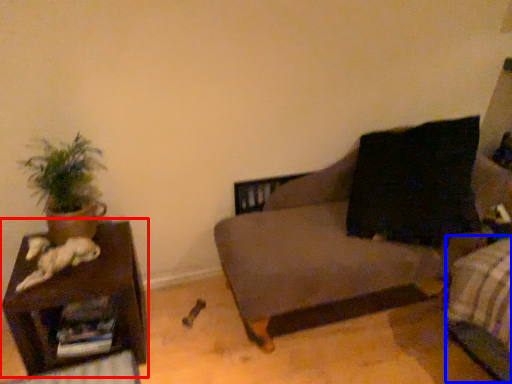
Question: Which point is closer to the camera, furniture (highlighted by a red box) or bed frame (highlighted by a blue box)?

Choices:
 (A) furniture
 (B) bed frame

Answer: (B)